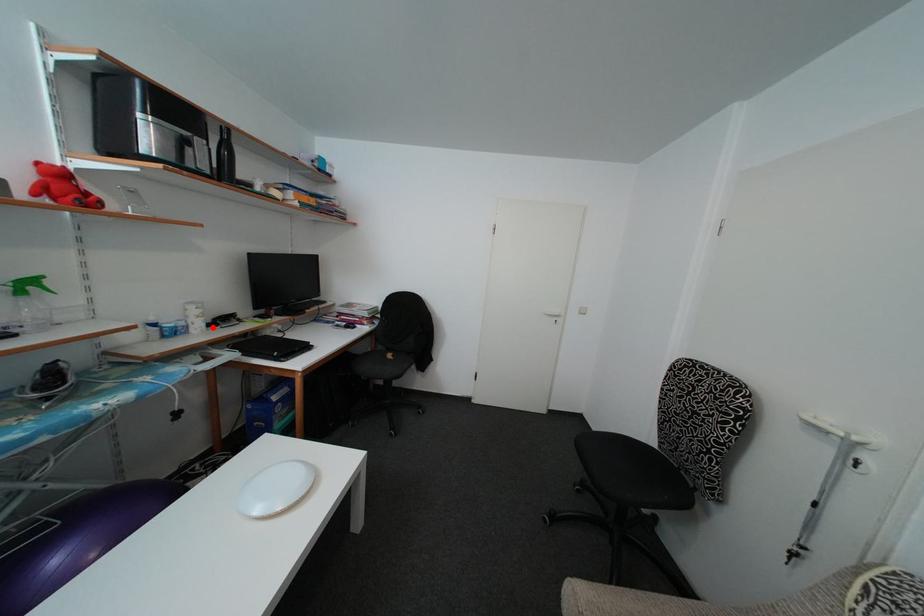
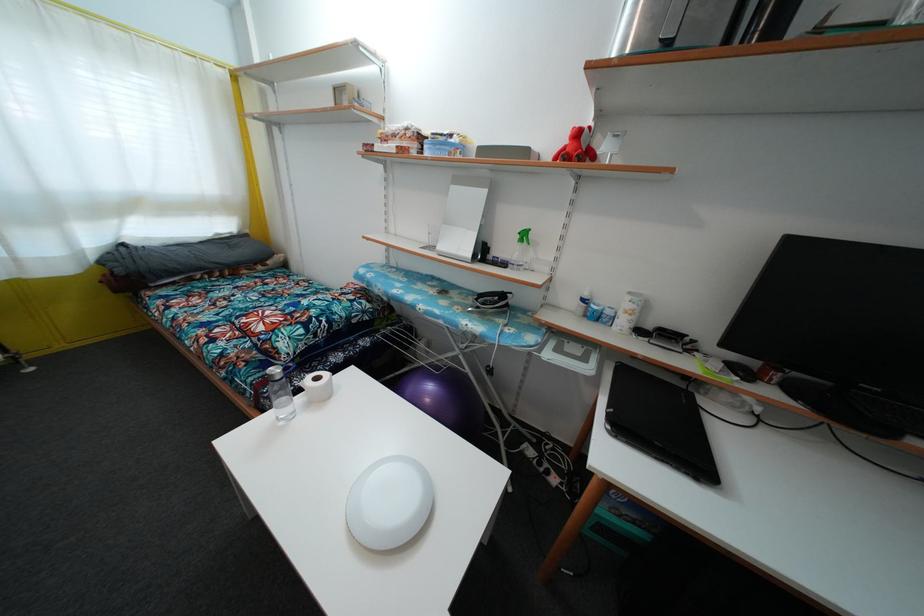
Question: I am providing you with two images of the same scene from different viewpoints. A red point is marked on the first image. At the location where the point appears in image 1, is it still visible in image 2?

Choices:
 (A) Yes
 (B) No

Answer: (A)